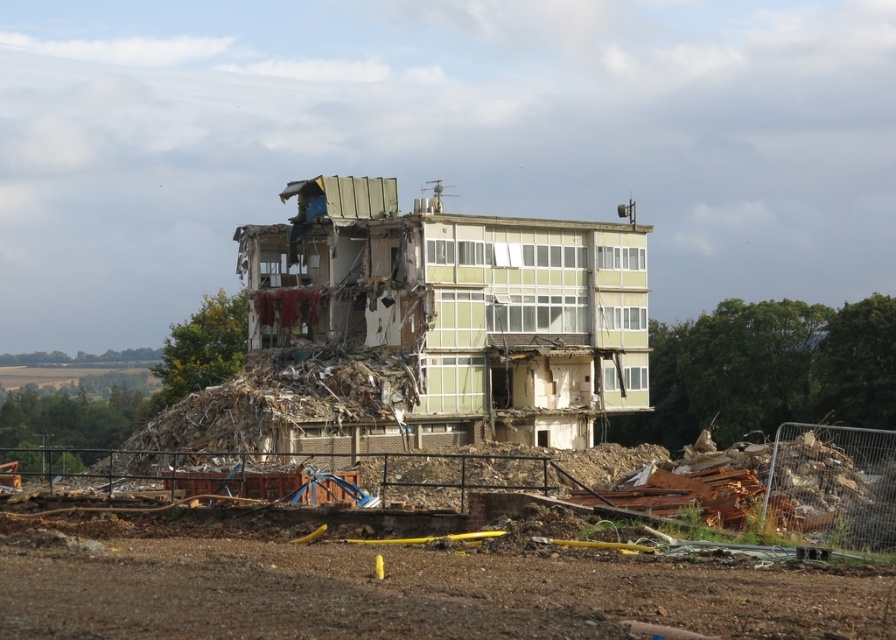
Question: Estimate the real-world distances between objects in this image. Which object is farther from the green glass building at center?

Choices:
 (A) green concrete building at center
 (B) rusty metal debris at center

Answer: (B)

Question: Which of the following is the closest to the observer?

Choices:
 (A) rusty metal debris at center
 (B) green concrete building at center

Answer: (A)

Question: Does green concrete building at center have a larger size compared to rusty metal debris at center?

Choices:
 (A) yes
 (B) no

Answer: (A)

Question: Where is green concrete building at center located in relation to green glass building at center in the image?

Choices:
 (A) left
 (B) right

Answer: (B)

Question: Where is green concrete building at center located in relation to green glass building at center in the image?

Choices:
 (A) right
 (B) left

Answer: (A)

Question: Which object appears closest to the camera in this image?

Choices:
 (A) green concrete building at center
 (B) green glass building at center
 (C) rusty metal debris at center

Answer: (C)